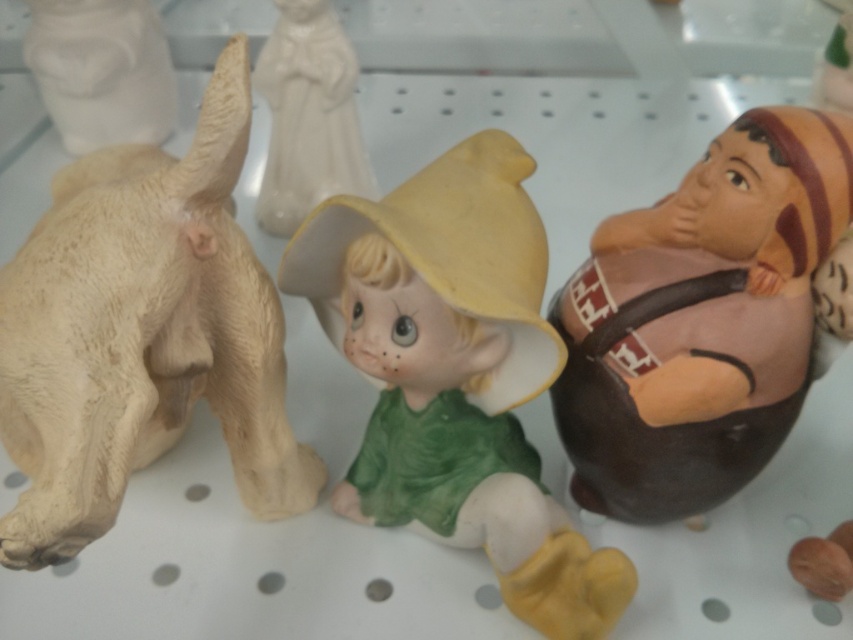
Is beige matte animal at left to the right of brown matte figure at right from the viewer's perspective?

Incorrect, beige matte animal at left is not on the right side of brown matte figure at right.

Who is shorter, beige matte animal at left or brown matte figure at right?

brown matte figure at right is shorter.

Describe the element at coordinates (142, 333) in the screenshot. I see `beige matte animal at left` at that location.

You are a GUI agent. You are given a task and a screenshot of the screen. Output one action in this format:
    pyautogui.click(x=<x>, y=<y>)
    Task: Click on the beige matte animal at left
    Image resolution: width=853 pixels, height=640 pixels.
    Given the screenshot: What is the action you would take?
    pyautogui.click(x=142, y=333)

Who is positioned more to the right, beige matte animal at left or white matte statue at upper left?

Positioned to the right is beige matte animal at left.

Can you confirm if beige matte animal at left is smaller than white matte statue at upper left?

Actually, beige matte animal at left might be larger than white matte statue at upper left.

Does point (36, 237) lie behind point (36, 3)?

No.

Where is `beige matte animal at left`? beige matte animal at left is located at coordinates (142, 333).

Is white matte statue at upper center bigger than white matte statue at upper left?

Yes.

Does white matte statue at upper center appear over white matte statue at upper left?

Incorrect, white matte statue at upper center is not positioned above white matte statue at upper left.

Does point (352, 179) come closer to viewer compared to point (84, 20)?

Yes, it is in front of point (84, 20).

You are a GUI agent. You are given a task and a screenshot of the screen. Output one action in this format:
    pyautogui.click(x=<x>, y=<y>)
    Task: Click on the white matte statue at upper center
    The width and height of the screenshot is (853, 640).
    Given the screenshot: What is the action you would take?
    pyautogui.click(x=308, y=116)